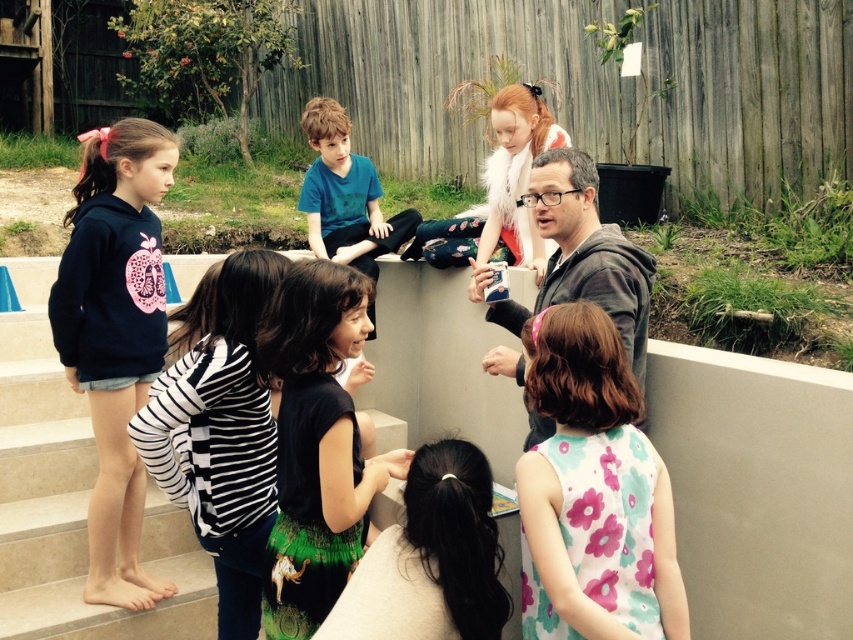
You are a photographer standing at the bottom of the beige concrete stairs at lower left. You want to take a photo of the blue cotton shirt at center. Which direction should you move to get a better shot?

The beige concrete stairs at lower left is located below the blue cotton shirt at center, so you should move upwards to get a better shot of the blue cotton shirt at center.

You are a child in the group and want to move from your current position to the adult holding the book. The adult is standing at point (x=345, y=220). There is an obstacle at point (x=0, y=608). Can you safely walk directly to the adult without going near the obstacle?

Point (x=0, y=608) is in front of point (x=345, y=220). So the obstacle is between you and the adult. You should find another path to avoid it.